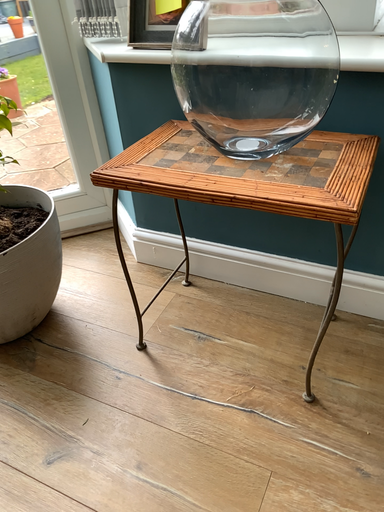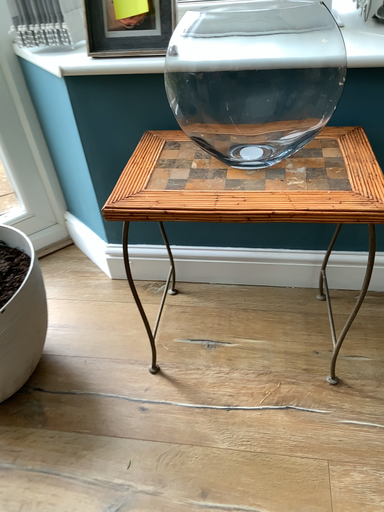
Question: How did the camera likely rotate when shooting the video?

Choices:
 (A) rotated left
 (B) rotated right

Answer: (B)